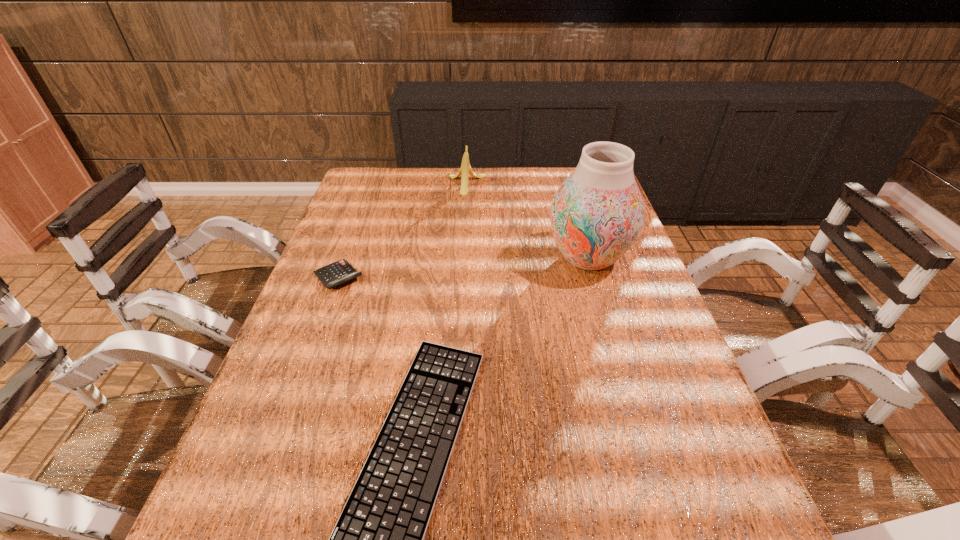
Identify the location of object present at the left edge. (341, 271).

The height and width of the screenshot is (540, 960). In order to click on object that is at the right edge in this screenshot , I will do `click(597, 213)`.

Where is `vacant space at the far edge of the desktop`? The image size is (960, 540). vacant space at the far edge of the desktop is located at coordinates (477, 179).

In order to click on free space at the left edge of the desktop in this screenshot , I will do `click(383, 227)`.

Find the location of `free space at the right edge of the desktop`. free space at the right edge of the desktop is located at coordinates (633, 271).

In the image, there is a desktop. Where is `vacant space at the far left corner`? vacant space at the far left corner is located at coordinates (360, 183).

You are a GUI agent. You are given a task and a screenshot of the screen. Output one action in this format:
    pyautogui.click(x=<x>, y=<y>)
    Task: Click on the free space between the rightmost object and the banana
    
    Given the screenshot: What is the action you would take?
    pyautogui.click(x=527, y=221)

At what (x,y) coordinates should I click in order to perform the action: click on free space between the leftmost object and the banana. Please return your answer as a coordinate pair (x, y). The width and height of the screenshot is (960, 540). Looking at the image, I should click on (402, 231).

Where is `free spot between the farthest object and the vase`? This screenshot has height=540, width=960. free spot between the farthest object and the vase is located at coordinates pos(527,221).

Where is `free area in between the farthest object and the calculator`? free area in between the farthest object and the calculator is located at coordinates (402, 231).